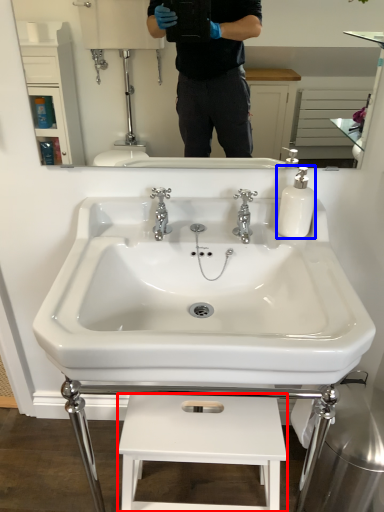
Question: Which object is further to the camera taking this photo, lift (highlighted by a red box) or soap dispenser (highlighted by a blue box)?

Choices:
 (A) lift
 (B) soap dispenser

Answer: (B)